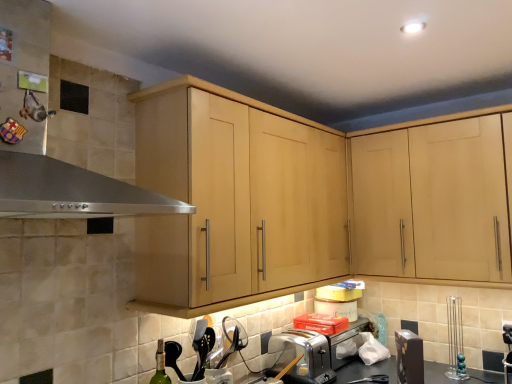
Question: Considering their positions, is stainless steel exhaust hood at upper left located in front of or behind satin silver toaster at lower center?

Choices:
 (A) front
 (B) behind

Answer: (A)

Question: In terms of size, does stainless steel exhaust hood at upper left appear bigger or smaller than satin silver toaster at lower center?

Choices:
 (A) small
 (B) big

Answer: (B)

Question: Which object is the farthest from the satin silver toaster at lower center?

Choices:
 (A) green glass bottle at lower left
 (B) matte black toaster at lower center, marked as the 1th appliance in a left-to-right arrangement
 (C) metallic silver utensil holder at right, which ranks as the 2th appliance in front-to-back order
 (D) stainless steel exhaust hood at upper left
 (E) light wood cabinet at center, the 2th cabinetry viewed from the right

Answer: (D)

Question: Which object is positioned farthest from the metallic silver utensil holder at right, which appears as the first appliance when viewed from the right?

Choices:
 (A) light wood cabinet at center, the 2th cabinetry viewed from the right
 (B) green glass bottle at lower left
 (C) satin silver toaster at lower center
 (D) stainless steel exhaust hood at upper left
 (E) light wood cabinet at upper right, which is the 1th cabinetry in right-to-left order

Answer: (D)